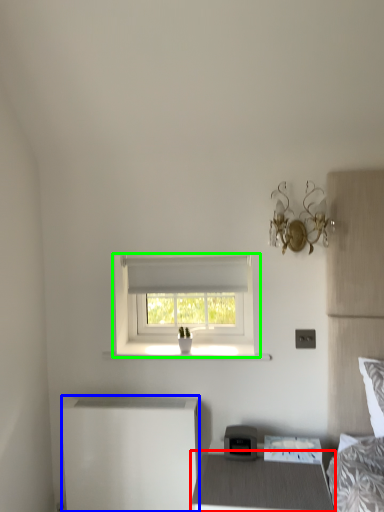
Question: Which object is the farthest from nightstand (highlighted by a red box)? Choose among these: changing table (highlighted by a blue box) or window (highlighted by a green box).

Choices:
 (A) changing table
 (B) window

Answer: (B)